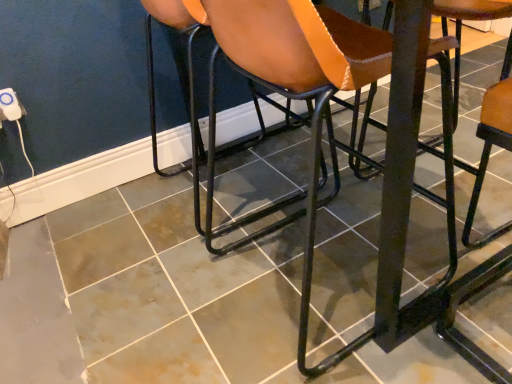
Question: Is white plastic electric outlet at lower left at the right side of metallic black stool at right, which is the third chair in left-to-right order?

Choices:
 (A) yes
 (B) no

Answer: (B)

Question: Does white plastic electric outlet at lower left have a greater width compared to metallic black stool at right, which is the third chair in left-to-right order?

Choices:
 (A) yes
 (B) no

Answer: (B)

Question: Is white plastic electric outlet at lower left located outside metallic black stool at right, which is the third chair in left-to-right order?

Choices:
 (A) yes
 (B) no

Answer: (A)

Question: From the image's perspective, is white plastic electric outlet at lower left located beneath metallic black stool at right, which ranks as the 1th chair in right-to-left order?

Choices:
 (A) yes
 (B) no

Answer: (B)

Question: Is white plastic electric outlet at lower left aimed at metallic black stool at right, which ranks as the 1th chair in right-to-left order?

Choices:
 (A) no
 (B) yes

Answer: (A)

Question: Can you confirm if white plastic electric outlet at lower left is bigger than metallic black stool at right, which ranks as the 1th chair in right-to-left order?

Choices:
 (A) yes
 (B) no

Answer: (B)

Question: Is the surface of brown leather chair at center, the 3th chair viewed from the right, in direct contact with white plastic electric outlet at lower left?

Choices:
 (A) no
 (B) yes

Answer: (A)

Question: Does brown leather chair at center, the 3th chair viewed from the right, come in front of white plastic electric outlet at lower left?

Choices:
 (A) yes
 (B) no

Answer: (A)

Question: From a real-world perspective, is brown leather chair at center, the 3th chair viewed from the right, on white plastic electric outlet at lower left?

Choices:
 (A) no
 (B) yes

Answer: (A)

Question: Can you confirm if brown leather chair at center, the 3th chair viewed from the right, is wider than white plastic electric outlet at lower left?

Choices:
 (A) no
 (B) yes

Answer: (B)

Question: Is brown leather chair at center, the 1th chair from the left, further to the viewer compared to white plastic electric outlet at lower left?

Choices:
 (A) yes
 (B) no

Answer: (B)

Question: From a real-world perspective, is brown leather chair at center, the 1th chair from the left, positioned under white plastic electric outlet at lower left based on gravity?

Choices:
 (A) no
 (B) yes

Answer: (B)

Question: Is brown leather chair at center, the 3th chair viewed from the right, shorter than brown leather chair at center, arranged as the second chair when viewed from the right?

Choices:
 (A) no
 (B) yes

Answer: (B)